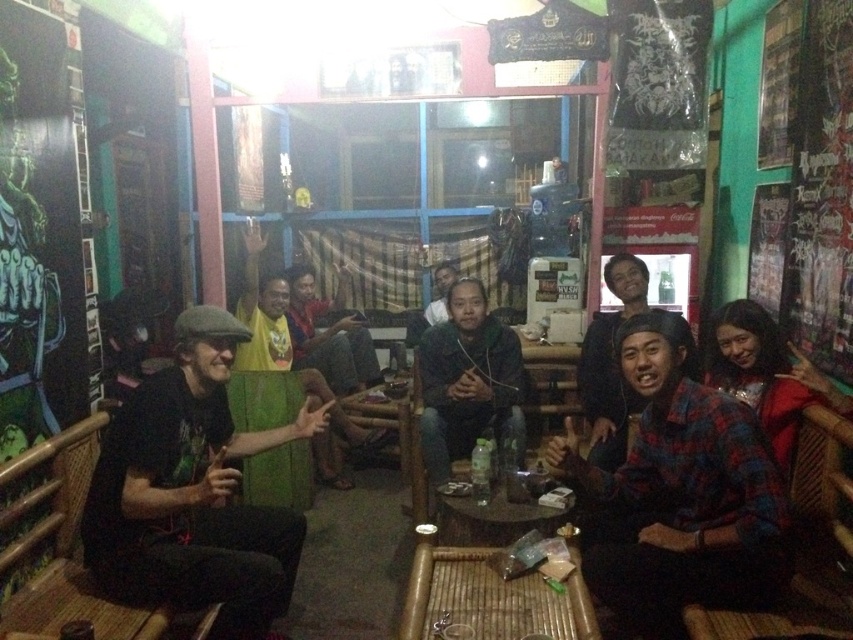
You are organizing a photoshoot and need to position a model between the plaid flannel shirt at right and the yellow fabric at center. Which object should the model stand closer to to ensure they are centered between them?

The model should stand closer to the yellow fabric at center because the plaid flannel shirt at right is to the right of the yellow fabric at center, so the center point between them would be closer to the yellow fabric.

You are organizing a clothing sale and need to determine which item takes up more space on the display rack. Based on the image, which of the two items, the plaid flannel shirt at right or the yellow fabric at center, has a greater width?

The plaid flannel shirt at right has a greater width than the yellow fabric at center according to the description.